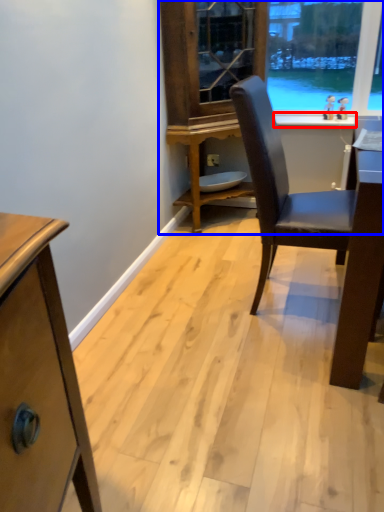
Question: Which object is closer to the camera taking this photo, window sill (highlighted by a red box) or dresser (highlighted by a blue box)?

Choices:
 (A) window sill
 (B) dresser

Answer: (B)